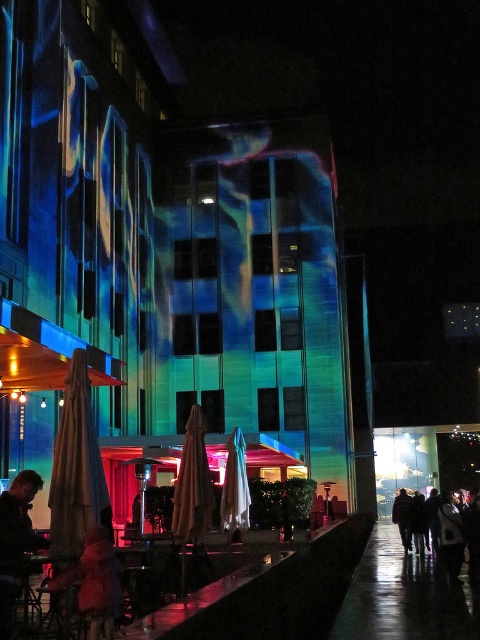
Question: Which object appears farthest from the camera in this image?

Choices:
 (A) white fabric umbrella at center
 (B) beige fabric umbrella at left
 (C) silhouette clothing at lower right

Answer: (A)

Question: Which object appears farthest from the camera in this image?

Choices:
 (A) leather jacket at lower left
 (B) beige fabric umbrella at center

Answer: (B)

Question: Does beige fabric umbrella at left appear under silhouette clothing at lower right?

Choices:
 (A) yes
 (B) no

Answer: (B)

Question: Does beige fabric umbrella at center have a greater width compared to fuzzy pink coat at lower left?

Choices:
 (A) yes
 (B) no

Answer: (A)

Question: Which of the following is the farthest from the observer?

Choices:
 (A) leather jacket at lower left
 (B) fuzzy pink coat at lower left
 (C) beige fabric umbrella at left

Answer: (A)

Question: Does silhouette clothing at lower right appear on the right side of white fabric umbrella at center?

Choices:
 (A) yes
 (B) no

Answer: (A)